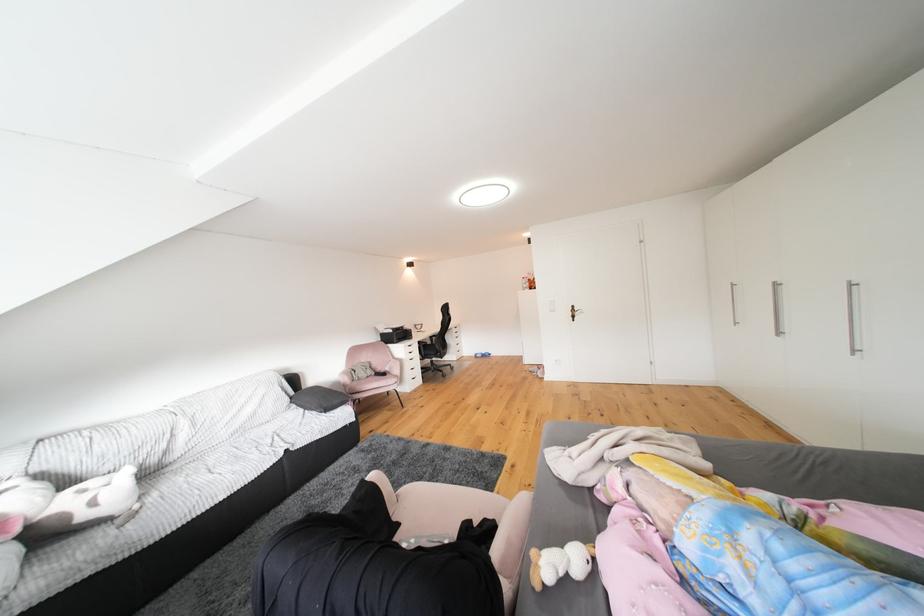
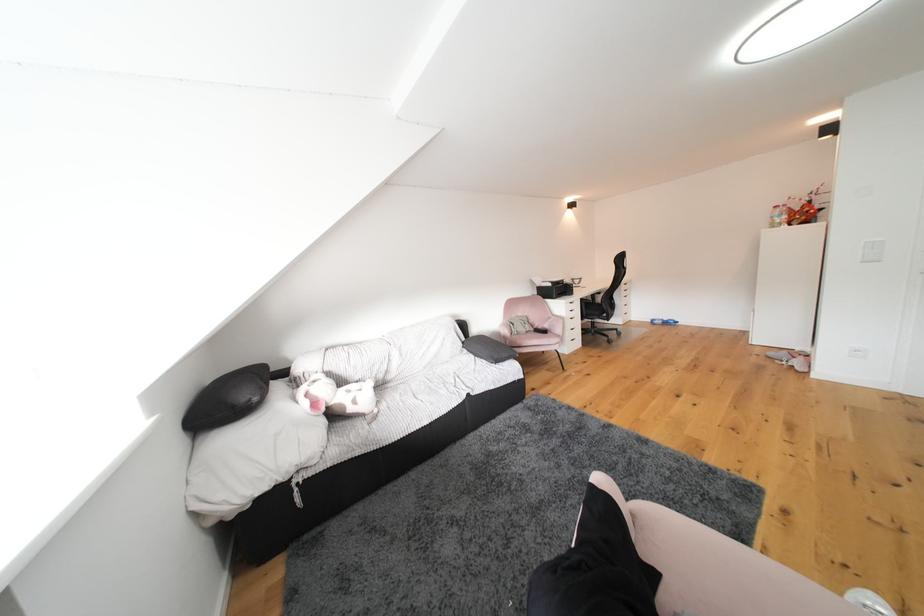
Locate, in the second image, the point that corresponds to (x=427, y=341) in the first image.

(590, 297)